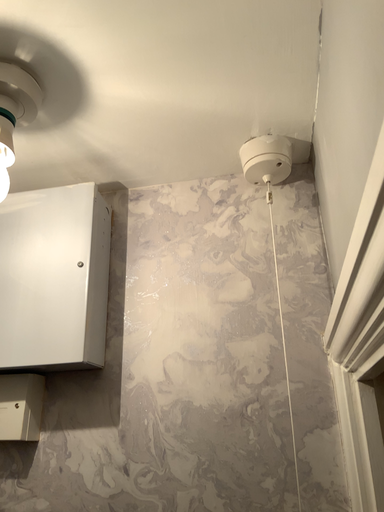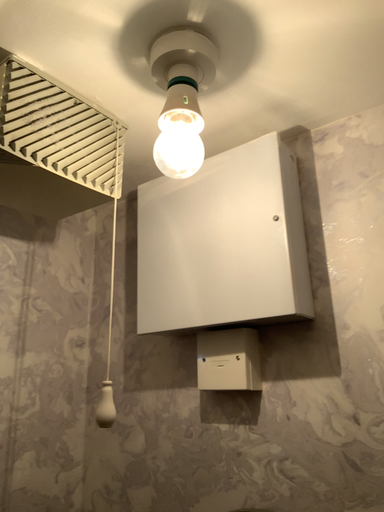
Question: Which way did the camera rotate in the video?

Choices:
 (A) rotated downward
 (B) rotated upward

Answer: (A)